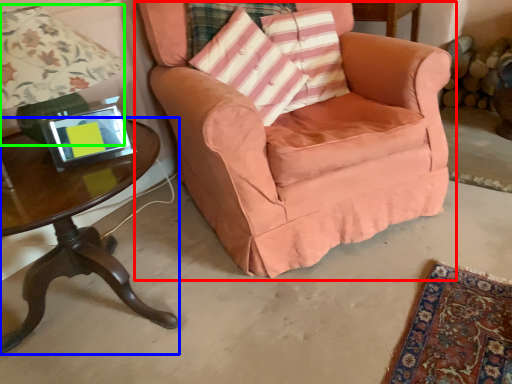
Question: Which is farther away from chair (highlighted by a red box)? table (highlighted by a blue box) or lamp (highlighted by a green box)?

Choices:
 (A) table
 (B) lamp

Answer: (A)